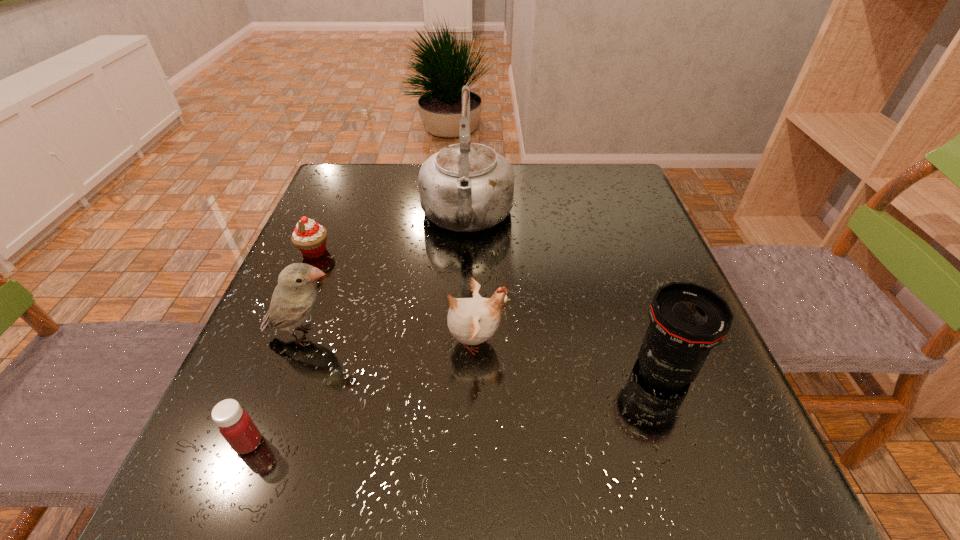
You are a GUI agent. You are given a task and a screenshot of the screen. Output one action in this format:
    pyautogui.click(x=<x>, y=<y>)
    Task: Click on the free location located on the right of the cupcake
    This screenshot has height=540, width=960.
    Given the screenshot: What is the action you would take?
    pyautogui.click(x=420, y=251)

Find the location of a particular element. Image resolution: width=960 pixels, height=540 pixels. vacant area located 0.230m on the back of the nearest object is located at coordinates (297, 322).

At what (x,y) coordinates should I click in order to perform the action: click on object that is at the far edge. Please return your answer as a coordinate pair (x, y). This screenshot has width=960, height=540. Looking at the image, I should click on (466, 187).

I want to click on object at the near edge, so click(x=235, y=425).

Find the location of a particular element. The width and height of the screenshot is (960, 540). bird that is at the left edge is located at coordinates (294, 298).

Image resolution: width=960 pixels, height=540 pixels. In order to click on cupcake at the left edge in this screenshot , I will do `click(309, 237)`.

Where is `medicine present at the left edge`? medicine present at the left edge is located at coordinates (235, 425).

The height and width of the screenshot is (540, 960). I want to click on object that is at the right edge, so click(x=686, y=320).

At what (x,y) coordinates should I click in order to perform the action: click on object that is at the near left corner. Please return your answer as a coordinate pair (x, y). The width and height of the screenshot is (960, 540). Looking at the image, I should click on 235,425.

In the image, there is a desktop. Where is `free space at the far edge`? This screenshot has width=960, height=540. free space at the far edge is located at coordinates click(562, 186).